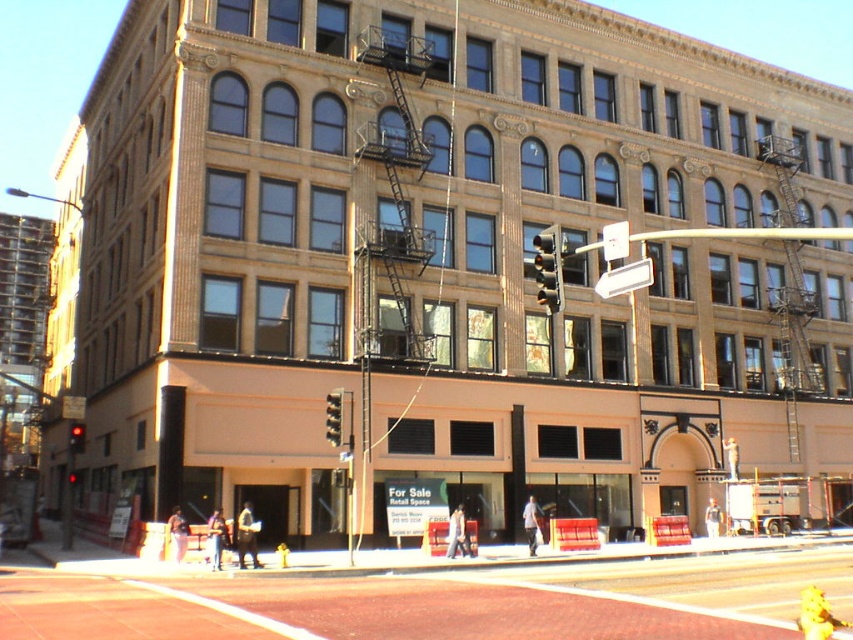
You are standing at the point with coordinates point [77,432] and want to walk towards the building entrance. Is the point [328,422] located in front of or behind your current position relative to the building?

Point [328,422] is in front of point [77,432], so the point [328,422] is located in front of your current position when facing the building.

You are a delivery driver who needs to park your vehicle at the metallic traffic light at center. The parking spot you want is exactly 30 meters away from the camera. Is the parking spot within the allowed distance?

The metallic traffic light at center and camera are 33.44 meters apart from each other. Since the parking spot is exactly 30 meters away from the camera, it is within the allowed distance as 30 meters is less than 33.44 meters.